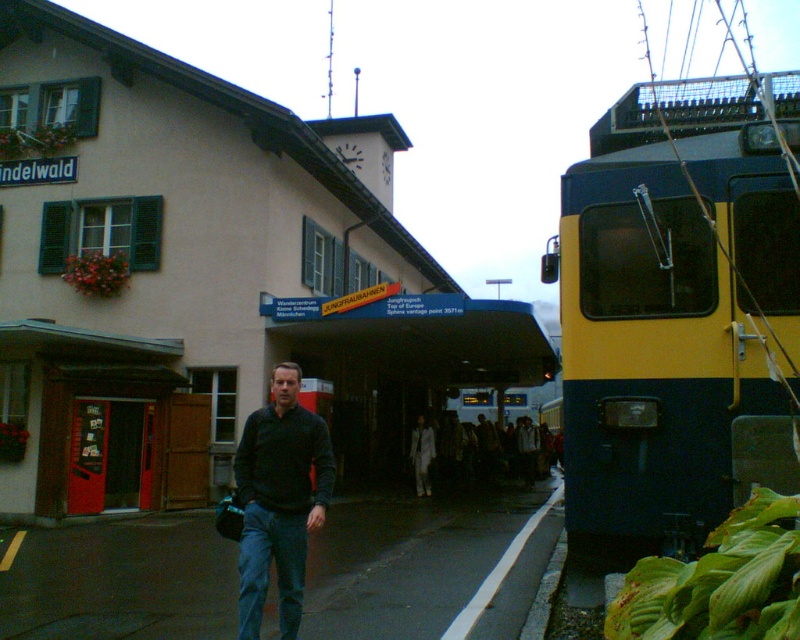
Question: Which point appears closest to the camera in this image?

Choices:
 (A) (46, 272)
 (B) (564, 394)
 (C) (262, 595)

Answer: (C)

Question: Can you confirm if yellow and blue train at right is bigger than black matte sweater at center?

Choices:
 (A) yes
 (B) no

Answer: (A)

Question: Estimate the real-world distances between objects in this image. Which object is closer to the yellow and blue train at right?

Choices:
 (A) yellow metal train at right
 (B) black matte sweater at center

Answer: (B)

Question: Which point appears closest to the camera in this image?

Choices:
 (A) (592, 451)
 (B) (256, 464)
 (C) (346, 429)

Answer: (B)

Question: Can you confirm if yellow metal train at right is smaller than black matte sweater at center?

Choices:
 (A) no
 (B) yes

Answer: (A)

Question: Does yellow metal train at right appear under yellow and blue train at right?

Choices:
 (A) yes
 (B) no

Answer: (A)